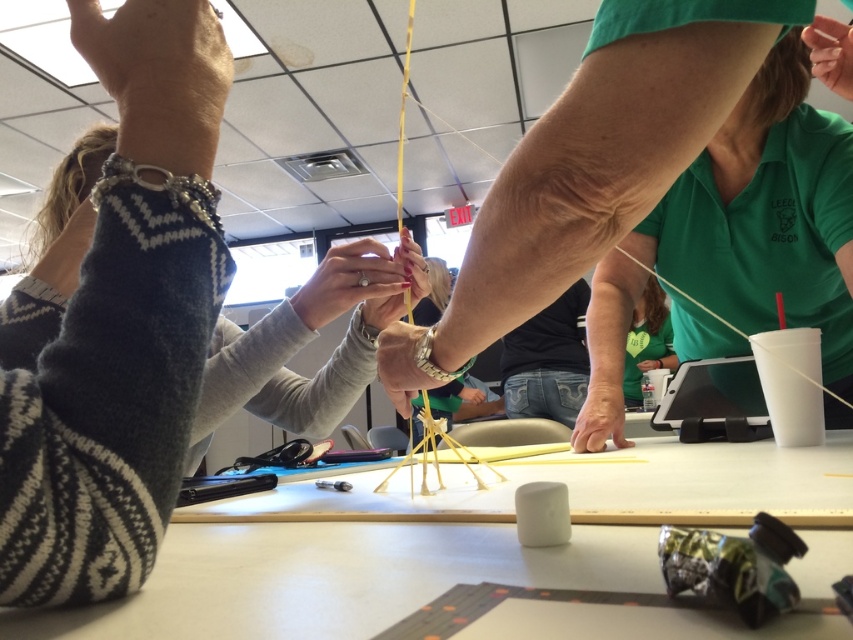
Question: Does smooth skin at upper right appear on the right side of matte green hand at center?

Choices:
 (A) no
 (B) yes

Answer: (B)

Question: Which object is the closest to the white knitted sweater at lower left?

Choices:
 (A) smooth skin hand at upper left
 (B) matte yellow stick at center

Answer: (B)

Question: Which point is farther from the camera taking this photo?

Choices:
 (A) (393, 365)
 (B) (846, 88)
 (C) (67, 291)
 (D) (576, 541)

Answer: (B)

Question: Can you confirm if matte yellow stick at center is wider than white knitted sweater at lower left?

Choices:
 (A) yes
 (B) no

Answer: (A)

Question: Is matte pink nail polish at center below smooth skin hand at upper left?

Choices:
 (A) yes
 (B) no

Answer: (A)

Question: Which point appears farthest from the camera in this image?

Choices:
 (A) (830, 68)
 (B) (604, 403)
 (C) (221, 38)

Answer: (B)